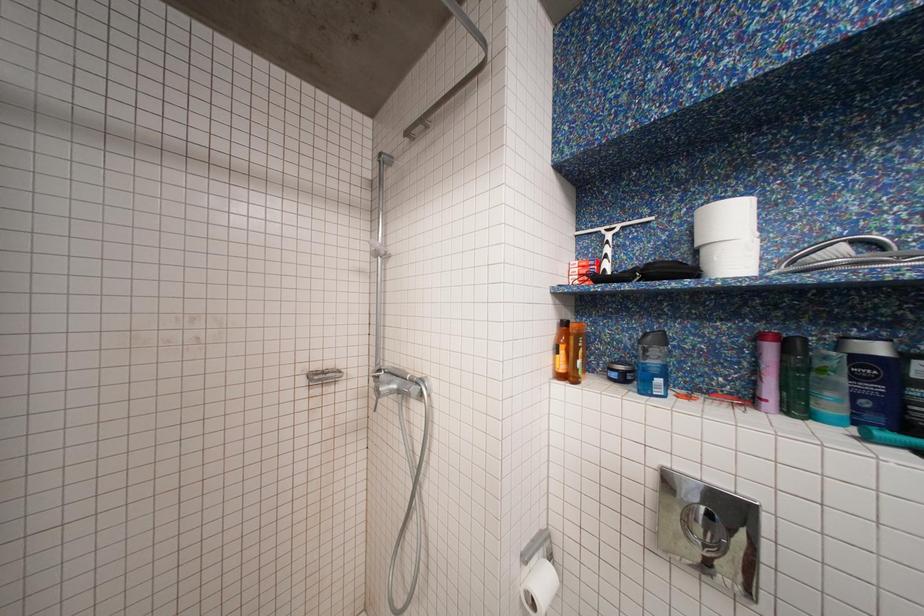
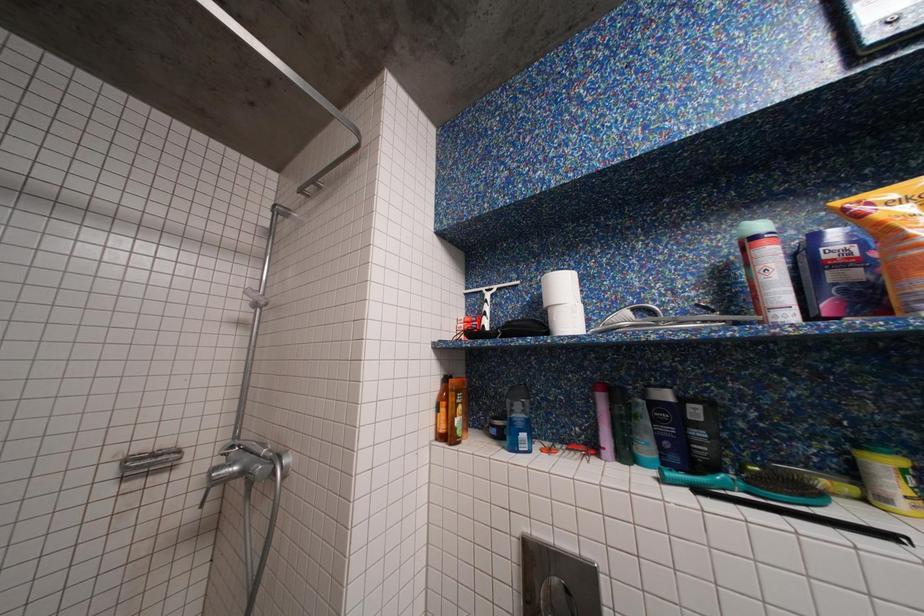
Question: How did the camera likely rotate?

Choices:
 (A) Left
 (B) Right
 (C) Up
 (D) Down

Answer: (B)